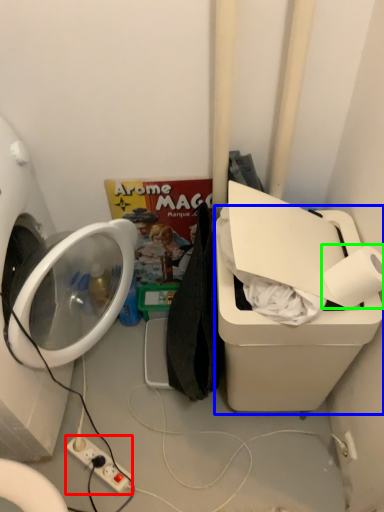
Question: Which is farther away from electric outlet (highlighted by a red box)? water cooler (highlighted by a blue box) or toilet paper (highlighted by a green box)?

Choices:
 (A) water cooler
 (B) toilet paper

Answer: (B)